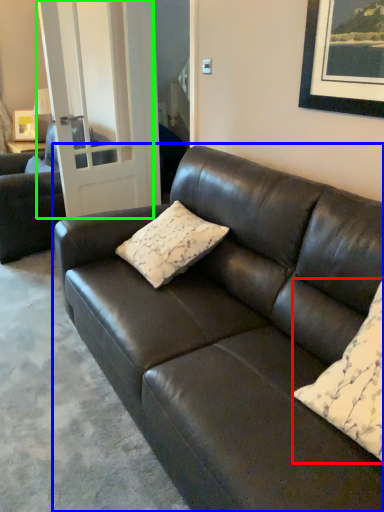
Question: Which object is the farthest from pillow (highlighted by a red box)? Choose among these: studio couch (highlighted by a blue box) or glass door (highlighted by a green box).

Choices:
 (A) studio couch
 (B) glass door

Answer: (B)